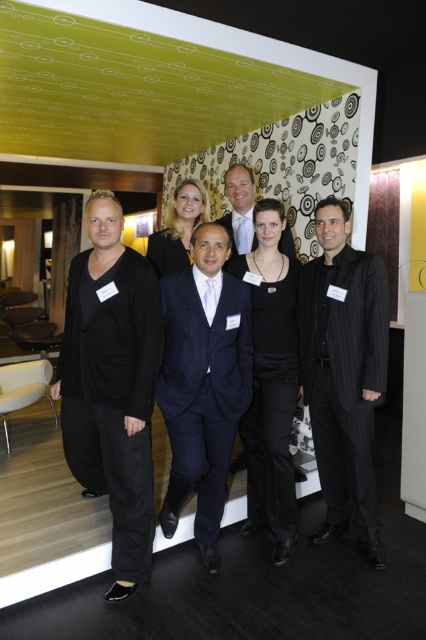
Consider the image. You are a photographer at the event and need to capture a photo of both the black satin dress at center and the matte black suit at center without any overlap. Given that your camera has a minimum focus distance of 60 centimeters, will you be able to achieve this?

The black satin dress at center is 65.66 centimeters away from the matte black suit at center. Since the minimum focus distance required is 60 centimeters, the photographer can capture both subjects without overlap as the distance between them meets the requirement.